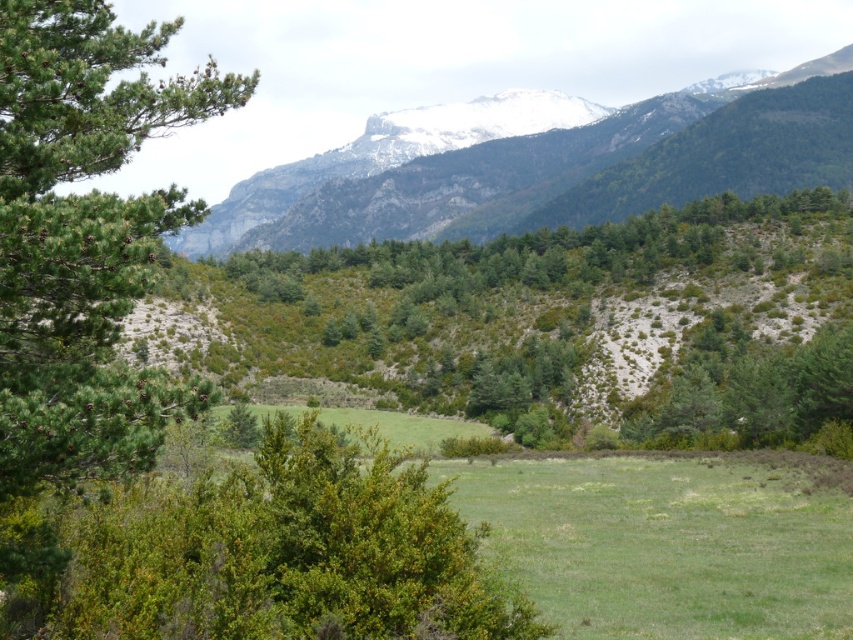
How distant is green leafy shrub at center from green needle-like at left?

The distance of green leafy shrub at center from green needle-like at left is 7.70 meters.

Does green leafy shrub at center appear on the left side of green needle-like at left?

Incorrect, green leafy shrub at center is not on the left side of green needle-like at left.

Does point (317, 618) lie in front of point (74, 342)?

Yes, point (317, 618) is in front of point (74, 342).

This screenshot has height=640, width=853. I want to click on green leafy shrub at center, so click(274, 554).

Who is taller, green leafy shrub at center or green forested mountain range at upper center?

With more height is green forested mountain range at upper center.

Is point (315, 532) positioned in front of point (479, 132)?

Yes, it is in front of point (479, 132).

The image size is (853, 640). Identify the location of green leafy shrub at center. (274, 554).

Is green needle-like at left smaller than green forested mountain range at upper center?

Correct, green needle-like at left occupies less space than green forested mountain range at upper center.

Which is in front, point (155, 401) or point (204, 243)?

Point (155, 401) is more forward.

Where is `green needle-like at left`? This screenshot has width=853, height=640. green needle-like at left is located at coordinates (82, 237).